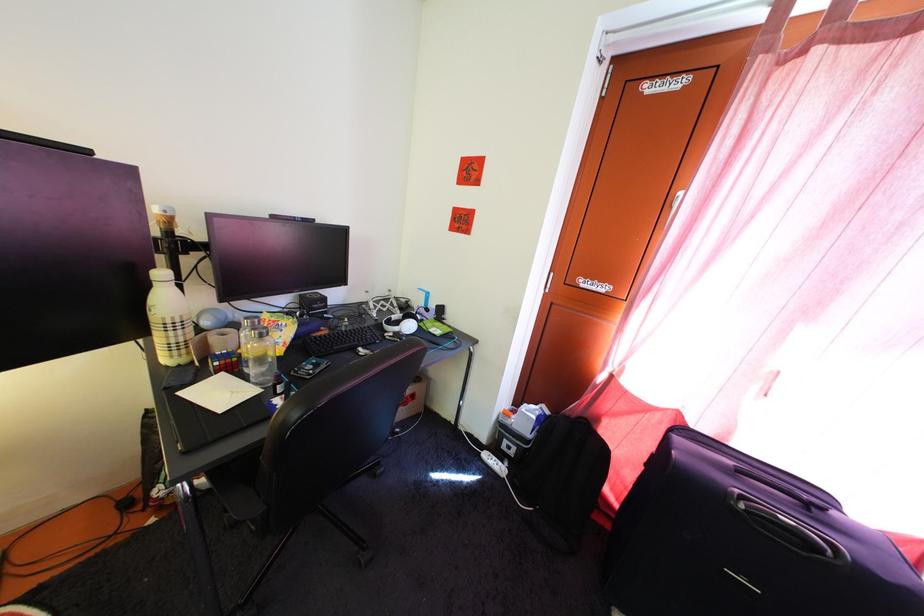
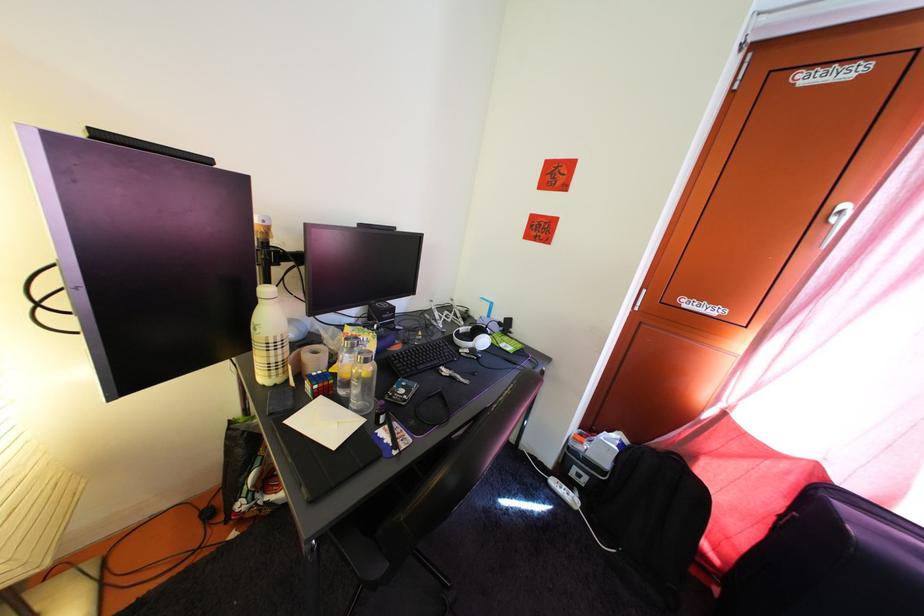
Question: Based on the continuous images, in which direction is the camera rotating? Reply with the corresponding letter.

Choices:
 (A) Left
 (B) Right
 (C) Up
 (D) Down

Answer: (A)